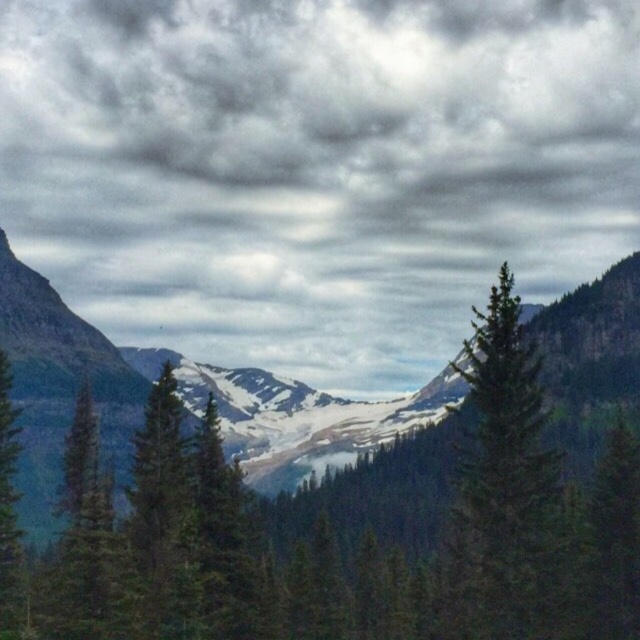
Is cloudy sky at upper center positioned in front of green matte tree at center?

No, cloudy sky at upper center is further to the viewer.

The height and width of the screenshot is (640, 640). What do you see at coordinates (330, 92) in the screenshot? I see `cloudy sky at upper center` at bounding box center [330, 92].

Image resolution: width=640 pixels, height=640 pixels. I want to click on cloudy sky at upper center, so 330,92.

Is point (534, 605) positioned before point (20, 580)?

Yes.

Which is behind, point (556, 520) or point (1, 428)?

The point (1, 428) is behind.

I want to click on green matte tree at center, so click(x=506, y=481).

Between cloudy sky at upper center and green matte tree at left, which one has more height?

With more height is cloudy sky at upper center.

The image size is (640, 640). I want to click on cloudy sky at upper center, so click(330, 92).

This screenshot has height=640, width=640. In order to click on cloudy sky at upper center in this screenshot , I will do `click(330, 92)`.